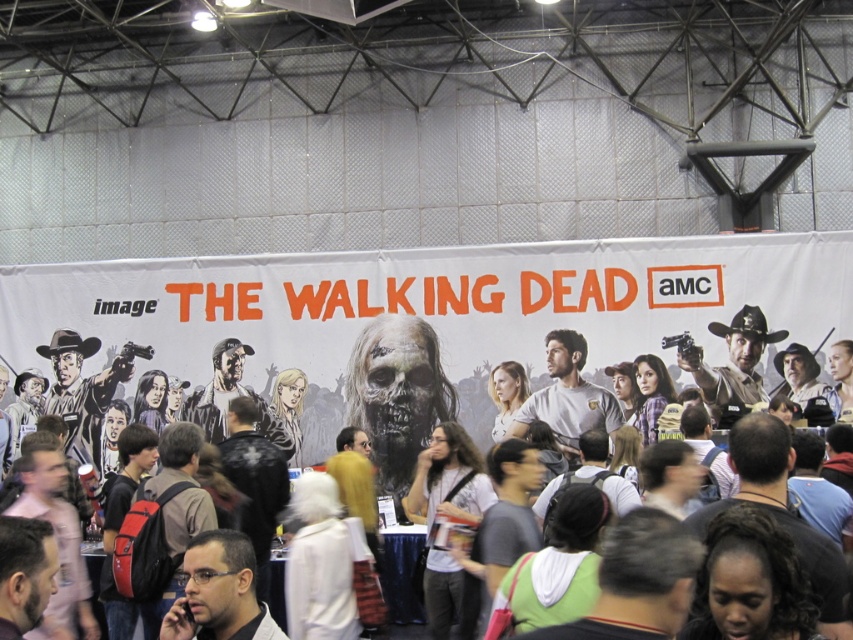
Question: Does white matte banner at center have a larger size compared to matte black backpack at center?

Choices:
 (A) no
 (B) yes

Answer: (A)

Question: Does white matte banner at center have a smaller size compared to matte black backpack at center?

Choices:
 (A) yes
 (B) no

Answer: (A)

Question: Which of the following is the closest to the observer?

Choices:
 (A) pos(479,417)
 (B) pos(517,266)

Answer: (A)

Question: Which object is closer to the camera taking this photo?

Choices:
 (A) matte black backpack at center
 (B) white matte banner at center

Answer: (A)

Question: Can you confirm if white matte banner at center is positioned to the left of matte black backpack at center?

Choices:
 (A) yes
 (B) no

Answer: (A)